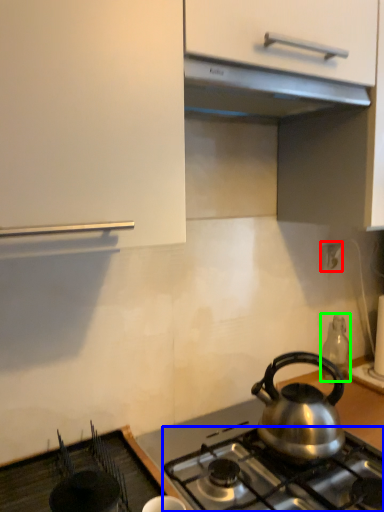
Question: Which object is the closest to the electric outlet (highlighted by a red box)? Choose among these: gas stove (highlighted by a blue box) or appliance (highlighted by a green box).

Choices:
 (A) gas stove
 (B) appliance

Answer: (B)